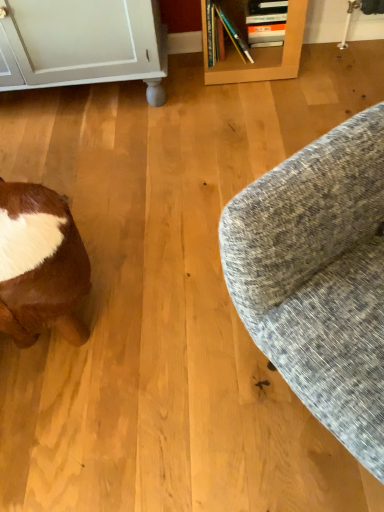
Question: Could brown fur at lower left be considered to be inside textured gray fabric couch at right?

Choices:
 (A) no
 (B) yes

Answer: (A)

Question: Does textured gray fabric couch at right have a greater width compared to brown fur at lower left?

Choices:
 (A) yes
 (B) no

Answer: (A)

Question: Does textured gray fabric couch at right come in front of brown fur at lower left?

Choices:
 (A) no
 (B) yes

Answer: (B)

Question: Considering the relative sizes of textured gray fabric couch at right and brown fur at lower left in the image provided, is textured gray fabric couch at right shorter than brown fur at lower left?

Choices:
 (A) no
 (B) yes

Answer: (A)

Question: Is textured gray fabric couch at right to the right of brown fur at lower left from the viewer's perspective?

Choices:
 (A) no
 (B) yes

Answer: (B)

Question: Considering the relative positions of textured gray fabric couch at right and brown fur at lower left in the image provided, is textured gray fabric couch at right to the left of brown fur at lower left from the viewer's perspective?

Choices:
 (A) no
 (B) yes

Answer: (A)

Question: Is brown fur at lower left at the left side of textured gray fabric couch at right?

Choices:
 (A) no
 (B) yes

Answer: (B)

Question: Can you confirm if brown fur at lower left is taller than textured gray fabric couch at right?

Choices:
 (A) yes
 (B) no

Answer: (B)

Question: Considering the relative sizes of brown fur at lower left and textured gray fabric couch at right in the image provided, is brown fur at lower left wider than textured gray fabric couch at right?

Choices:
 (A) yes
 (B) no

Answer: (B)

Question: Is brown fur at lower left looking in the opposite direction of textured gray fabric couch at right?

Choices:
 (A) yes
 (B) no

Answer: (B)

Question: Is brown fur at lower left touching textured gray fabric couch at right?

Choices:
 (A) no
 (B) yes

Answer: (A)

Question: Does brown fur at lower left come in front of textured gray fabric couch at right?

Choices:
 (A) no
 (B) yes

Answer: (A)

Question: Which is correct: brown fur at lower left is inside textured gray fabric couch at right, or outside of it?

Choices:
 (A) outside
 (B) inside

Answer: (A)